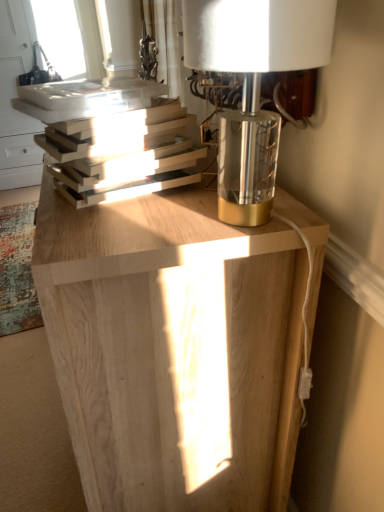
Question: Is hardcover books at left to the right of clear glass window at upper left from the viewer's perspective?

Choices:
 (A) no
 (B) yes

Answer: (B)

Question: Can you confirm if hardcover books at left is taller than clear glass window at upper left?

Choices:
 (A) no
 (B) yes

Answer: (A)

Question: Is hardcover books at left wider than clear glass window at upper left?

Choices:
 (A) no
 (B) yes

Answer: (A)

Question: Is hardcover books at left with clear glass window at upper left?

Choices:
 (A) no
 (B) yes

Answer: (A)

Question: Is hardcover books at left positioned behind clear glass window at upper left?

Choices:
 (A) no
 (B) yes

Answer: (A)

Question: Is natural wood table at center inside the boundaries of clear glass window at upper left, or outside?

Choices:
 (A) inside
 (B) outside

Answer: (B)

Question: From a real-world perspective, is natural wood table at center above or below clear glass window at upper left?

Choices:
 (A) below
 (B) above

Answer: (A)

Question: From their relative heights in the image, would you say natural wood table at center is taller or shorter than clear glass window at upper left?

Choices:
 (A) tall
 (B) short

Answer: (B)

Question: In terms of size, does natural wood table at center appear bigger or smaller than clear glass window at upper left?

Choices:
 (A) big
 (B) small

Answer: (B)

Question: Is clear glass window at upper left taller or shorter than hardcover books at left?

Choices:
 (A) tall
 (B) short

Answer: (A)

Question: Relative to hardcover books at left, is clear glass window at upper left in front or behind?

Choices:
 (A) behind
 (B) front

Answer: (A)

Question: Based on their positions, is clear glass window at upper left located to the left or right of hardcover books at left?

Choices:
 (A) left
 (B) right

Answer: (A)

Question: From the image's perspective, is clear glass window at upper left above or below hardcover books at left?

Choices:
 (A) above
 (B) below

Answer: (A)

Question: In terms of width, does hardcover books at left look wider or thinner when compared to natural wood table at center?

Choices:
 (A) wide
 (B) thin

Answer: (B)

Question: Based on their positions, is hardcover books at left located to the left or right of natural wood table at center?

Choices:
 (A) left
 (B) right

Answer: (A)